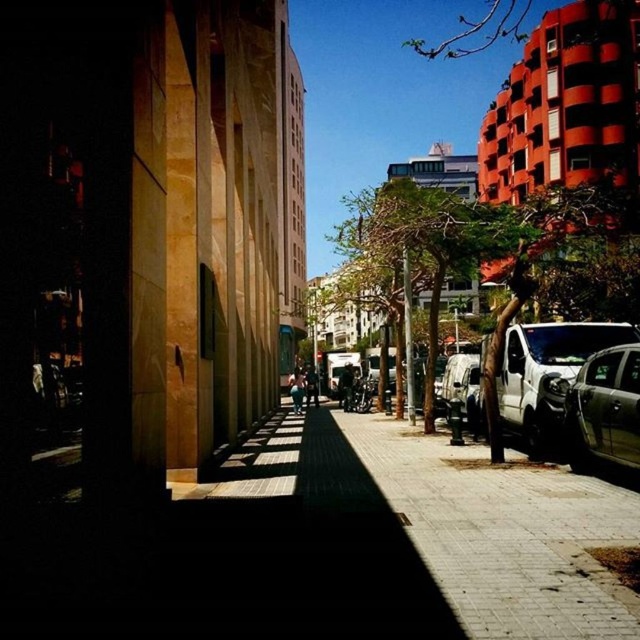
Question: In this image, where is paved stone sidewalk at center located relative to metallic silver suv at right?

Choices:
 (A) above
 (B) below

Answer: (B)

Question: Which object appears closest to the camera in this image?

Choices:
 (A) metallic silver suv at right
 (B) white matte van at right
 (C) paved stone sidewalk at center

Answer: (C)

Question: Considering the real-world distances, which object is farthest from the metallic silver suv at right?

Choices:
 (A) white matte van at right
 (B) metallic silver van at center
 (C) paved stone sidewalk at center

Answer: (B)

Question: Can you confirm if paved stone sidewalk at center is positioned below metallic silver van at center?

Choices:
 (A) yes
 (B) no

Answer: (A)

Question: Among these objects, which one is farthest from the camera?

Choices:
 (A) white matte van at right
 (B) metallic silver van at center
 (C) metallic silver suv at right
 (D) paved stone sidewalk at center

Answer: (B)

Question: From the image, what is the correct spatial relationship of paved stone sidewalk at center in relation to white matte van at right?

Choices:
 (A) right
 (B) left

Answer: (B)